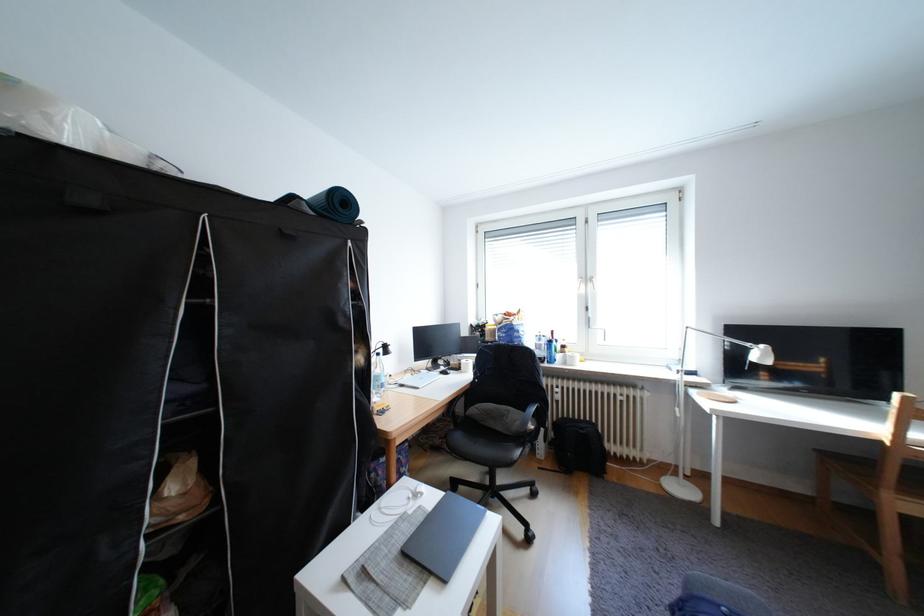
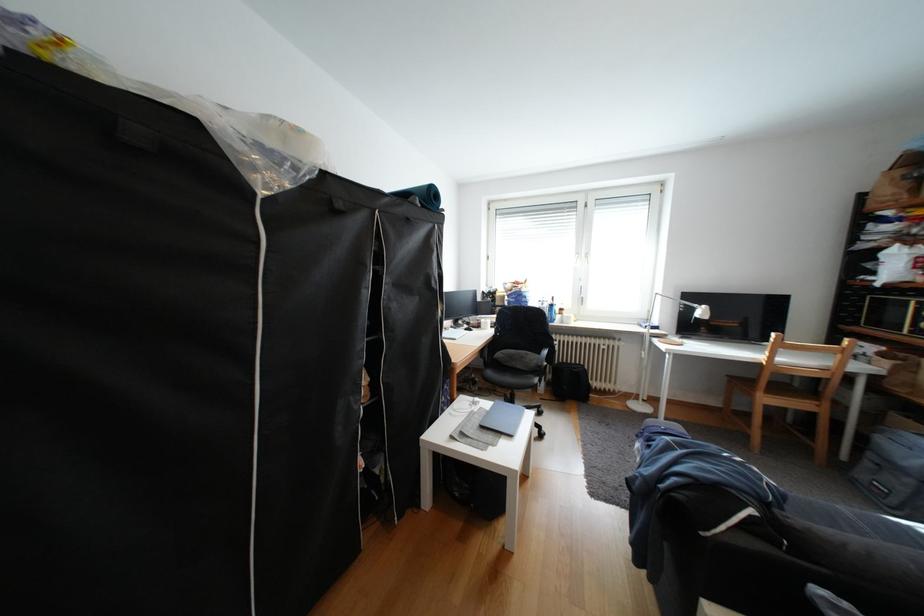
What movement of the cameraman would produce the second image?

The cameraman walked toward left, backward.